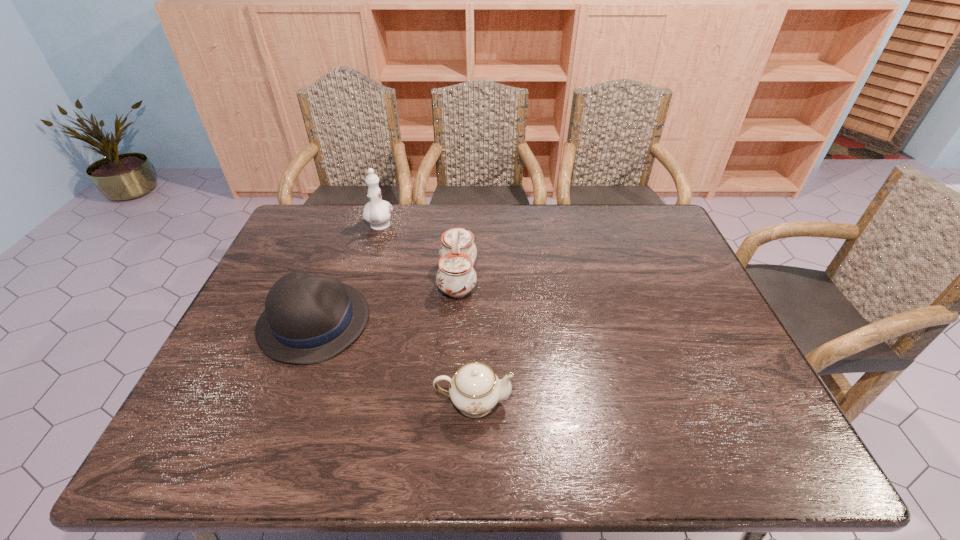
You are a GUI agent. You are given a task and a screenshot of the screen. Output one action in this format:
    pyautogui.click(x=<x>, y=<y>)
    Task: Click on the chinaware that is the second closest to the farthest object
    The image size is (960, 540).
    Given the screenshot: What is the action you would take?
    pyautogui.click(x=475, y=389)

Find the location of `vacant position in the image that satisfies the following two spatial constraints: 1. at the spout of the farthest object; 2. on the front-facing side of the second shortest object`. vacant position in the image that satisfies the following two spatial constraints: 1. at the spout of the farthest object; 2. on the front-facing side of the second shortest object is located at coordinates (352, 322).

Where is `vacant space that satisfies the following two spatial constraints: 1. at the spout of the tallest object; 2. on the front-facing side of the bowler hat`? Image resolution: width=960 pixels, height=540 pixels. vacant space that satisfies the following two spatial constraints: 1. at the spout of the tallest object; 2. on the front-facing side of the bowler hat is located at coordinates (352, 322).